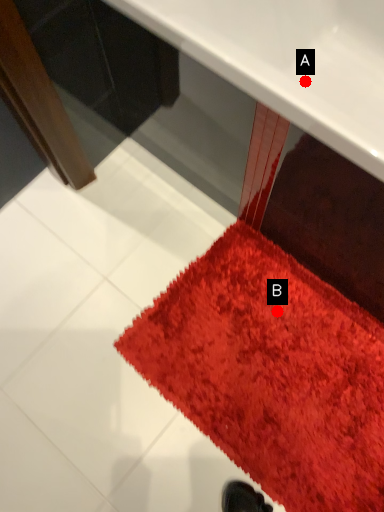
Question: Two points are circled on the image, labeled by A and B beside each circle. Which point is farther from the camera taking this photo?

Choices:
 (A) A is further
 (B) B is further

Answer: (A)